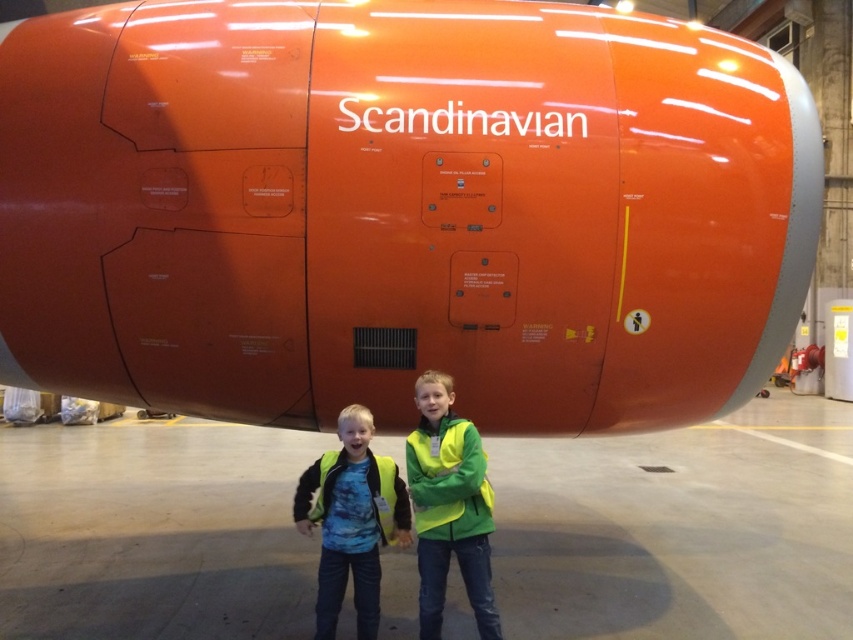
You are a safety inspector in the hangar. You need to check if the green matte jacket at center is positioned in a safe area away from the orange matte airplane at center. Based on their positions, can you confirm if the jacket is placed safely?

The orange matte airplane at center is located above the green matte jacket at center, so the jacket is positioned below the airplane. This placement might pose a safety risk if objects could fall from above, so the jacket should be moved to a safer location away from the airplane.

You are a maintenance worker entering the hangar and see the image. You need to place a tool box on the floor near the yellow reflective vests at center. Where should you place the tool box?

You should place the tool box near the yellow reflective vests at center at point (396, 512).